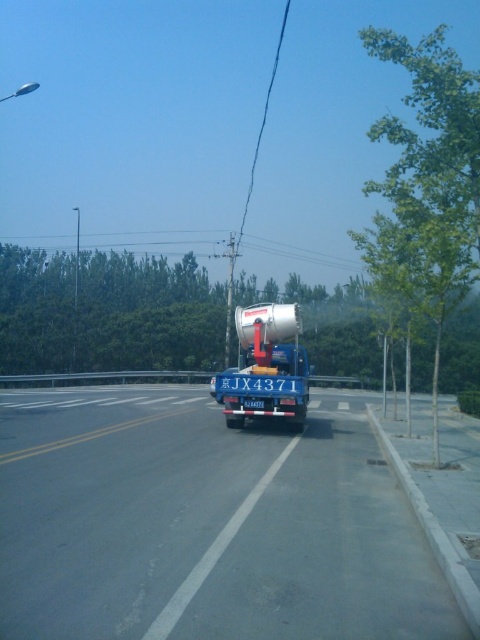
The height and width of the screenshot is (640, 480). What do you see at coordinates (204, 524) in the screenshot?
I see `blue metallic truck at center` at bounding box center [204, 524].

Find the location of a particular element. blue metallic truck at center is located at coordinates (204, 524).

This screenshot has width=480, height=640. Identify the location of blue metallic truck at center. (204, 524).

Locate an element on the screen. blue metallic truck at center is located at coordinates (204, 524).